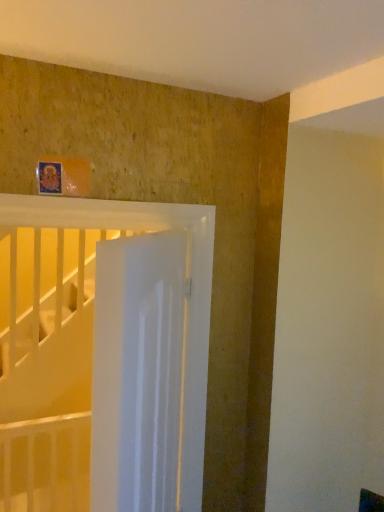
Where is `white glossy bed at upper center`? The width and height of the screenshot is (384, 512). white glossy bed at upper center is located at coordinates (185, 304).

This screenshot has height=512, width=384. Describe the element at coordinates (185, 304) in the screenshot. I see `white glossy bed at upper center` at that location.

What do you see at coordinates (137, 372) in the screenshot? The width and height of the screenshot is (384, 512). I see `white glossy door at center` at bounding box center [137, 372].

This screenshot has height=512, width=384. I want to click on white glossy door at center, so [x=137, y=372].

In order to face white glossy door at center, should I rotate leftwards or rightwards?

You should look left and rotate roughly 5.566 degrees.

Identify the location of white glossy bed at upper center. The width and height of the screenshot is (384, 512). (185, 304).

Based on the photo, can you confirm if white glossy bed at upper center is positioned to the right of white glossy door at center?

No.

Which is behind, white glossy bed at upper center or white glossy door at center?

white glossy bed at upper center is more distant.

Does point (204, 407) lie behind point (161, 333)?

Yes, point (204, 407) is farther from viewer.

From the image's perspective, is white glossy bed at upper center located above or below white glossy door at center?

Based on their image positions, white glossy bed at upper center is located above white glossy door at center.

From a real-world perspective, is white glossy bed at upper center physically located above or below white glossy door at center?

white glossy bed at upper center is situated higher than white glossy door at center in the real world.

Is white glossy bed at upper center thinner than white glossy door at center?

Correct, the width of white glossy bed at upper center is less than that of white glossy door at center.

Considering the sizes of white glossy bed at upper center and white glossy door at center in the image, is white glossy bed at upper center taller or shorter than white glossy door at center?

Considering their sizes, white glossy bed at upper center has more height than white glossy door at center.

Is white glossy bed at upper center smaller than white glossy door at center?

Indeed, white glossy bed at upper center has a smaller size compared to white glossy door at center.

Is white glossy door at center located within white glossy bed at upper center?

Actually, white glossy door at center is outside white glossy bed at upper center.

Can you see white glossy bed at upper center touching white glossy door at center?

white glossy bed at upper center and white glossy door at center are clearly separated.

Is white glossy bed at upper center aimed at white glossy door at center?

Yes.

Find the location of `bed located behind the white glossy door at center`. bed located behind the white glossy door at center is located at coordinates (185, 304).

Between white glossy door at center and white glossy bed at upper center, which one appears on the left side from the viewer's perspective?

white glossy bed at upper center is more to the left.

Which object is closer to the camera taking this photo, white glossy door at center or white glossy bed at upper center?

white glossy door at center is closer to the camera.

Considering the points (117, 243) and (194, 350), which point is in front, point (117, 243) or point (194, 350)?

The point (117, 243) is closer to the camera.

From the image's perspective, does white glossy door at center appear lower than white glossy bed at upper center?

Correct, white glossy door at center appears lower than white glossy bed at upper center in the image.

Based on the photo, from a real-world perspective, which is physically above, white glossy door at center or white glossy bed at upper center?

white glossy bed at upper center is physically above.

Can you confirm if white glossy door at center is thinner than white glossy bed at upper center?

No, white glossy door at center is not thinner than white glossy bed at upper center.

In terms of height, does white glossy door at center look taller or shorter compared to white glossy bed at upper center?

Clearly, white glossy door at center is shorter compared to white glossy bed at upper center.

In the scene shown: Can you confirm if white glossy door at center is smaller than white glossy bed at upper center?

No.

Would you say white glossy bed at upper center is part of white glossy door at center's contents?

Definitely not — white glossy bed at upper center is not inside white glossy door at center.

Is white glossy door at center with white glossy bed at upper center?

No, white glossy door at center is not in contact with white glossy bed at upper center.

Is white glossy bed at upper center at the back of white glossy door at center?

Yes, white glossy door at center is facing away from white glossy bed at upper center.

How different are the orientations of white glossy door at center and white glossy bed at upper center in degrees?

The angular difference between white glossy door at center and white glossy bed at upper center is 121 degrees.

Where is `door in front of the white glossy bed at upper center`? door in front of the white glossy bed at upper center is located at coordinates (137, 372).

At what (x,y) coordinates should I click in order to perform the action: click on door that appears below the white glossy bed at upper center (from a real-world perspective). Please return your answer as a coordinate pair (x, y). The height and width of the screenshot is (512, 384). Looking at the image, I should click on (137, 372).

Where is `bed that is above the white glossy door at center (from a real-world perspective)`? bed that is above the white glossy door at center (from a real-world perspective) is located at coordinates (185, 304).